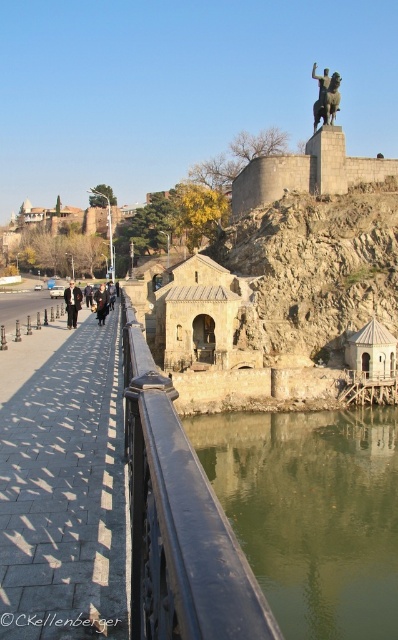
You are a tourist standing at the start of the bridge and want to reach the historic site at the end. The black concrete sidewalk at center is in your way. Can you walk around it?

The black concrete sidewalk at center is 16.30 meters from the viewer, so you can walk around it as it is a fixed structure on the bridge path.

You are a photographer standing on the bridge and want to capture both the dark brown leather jacket at left and the black leather jacket at center in your shot. Which jacket will appear larger in the photo?

The dark brown leather jacket at left will appear larger in the photo because it is taller than the black leather jacket at center.

You are a tourist standing on the bridge and want to take a photo of the bronze statue at upper center. To avoid including the black concrete sidewalk at center in your shot, which direction should you move?

The black concrete sidewalk at center is positioned on the left side of the bronze statue at upper center. To avoid including it, move to the right side of the bronze statue at upper center.